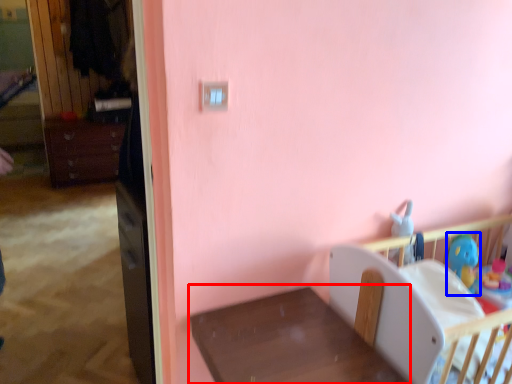
Question: Among these objects, which one is farthest to the camera, furniture (highlighted by a red box) or toy (highlighted by a blue box)?

Choices:
 (A) furniture
 (B) toy

Answer: (B)